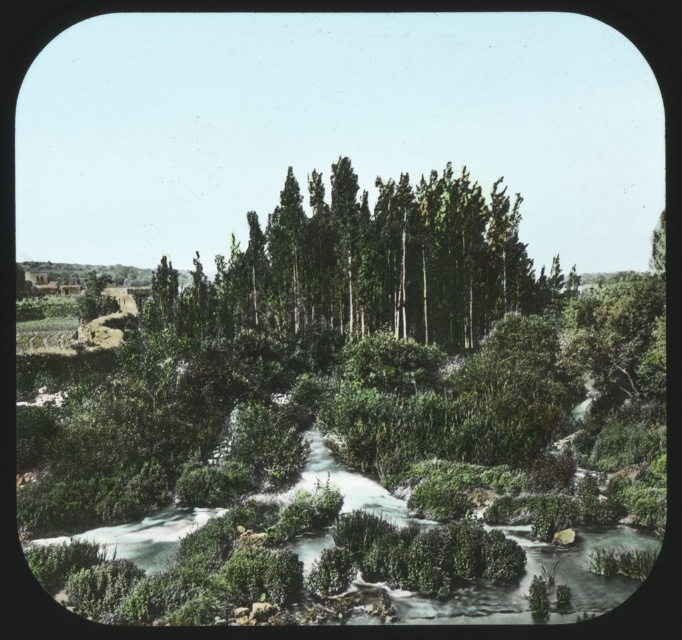
Question: Which of the following is the closest to the observer?

Choices:
 (A) click(531, 512)
 (B) click(406, 300)

Answer: (A)

Question: Can you confirm if green mossy river at center is positioned below green smooth trees at center?

Choices:
 (A) yes
 (B) no

Answer: (A)

Question: Where is green mossy river at center located in relation to green smooth trees at center in the image?

Choices:
 (A) below
 (B) above

Answer: (A)

Question: Does green mossy river at center have a larger size compared to green smooth trees at center?

Choices:
 (A) yes
 (B) no

Answer: (A)

Question: Which object is closer to the camera taking this photo?

Choices:
 (A) green mossy river at center
 (B) green smooth trees at center

Answer: (A)